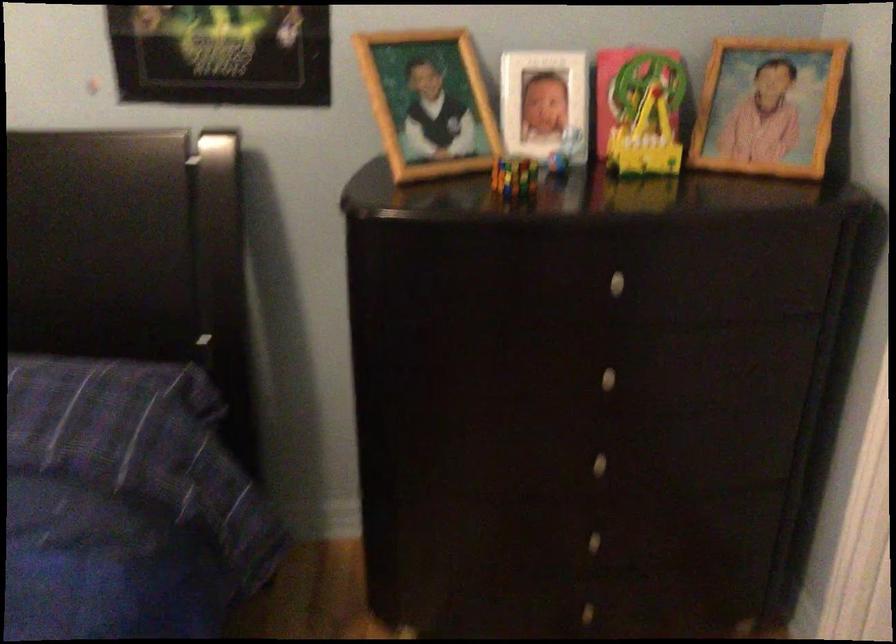
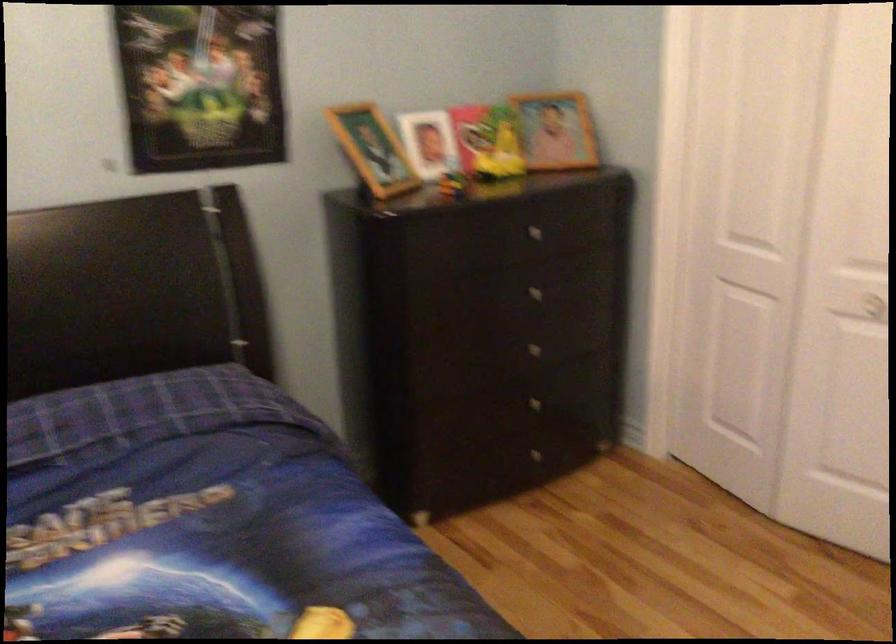
In the second image, find the point that corresponds to [621,381] in the first image.

(538, 292)